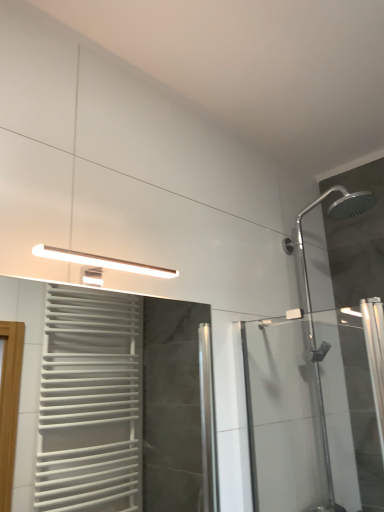
What is the approximate height of transparent glass shower door at right?

20.82 inches.

The height and width of the screenshot is (512, 384). What do you see at coordinates (311, 400) in the screenshot? I see `transparent glass shower door at right` at bounding box center [311, 400].

Where is `transparent glass shower door at right`? The width and height of the screenshot is (384, 512). transparent glass shower door at right is located at coordinates (311, 400).

Locate an element on the screen. transparent glass shower door at right is located at coordinates (311, 400).